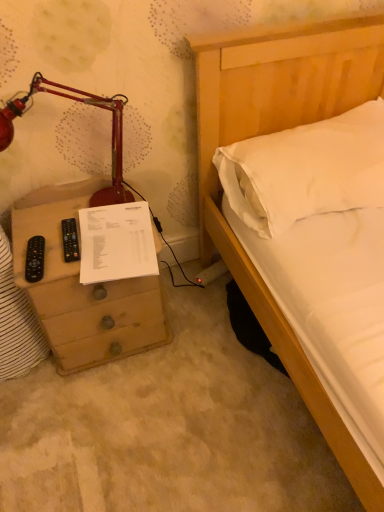
Question: Does point (256, 137) appear closer or farther from the camera than point (61, 229)?

Choices:
 (A) closer
 (B) farther

Answer: (B)

Question: From the image's perspective, is white soft pillow at upper right located above or below black plastic remote at left?

Choices:
 (A) above
 (B) below

Answer: (A)

Question: Which object is the farthest from the white paper at left?

Choices:
 (A) matte red lamp at left
 (B) black plastic remote at left
 (C) wooden chest of drawers at left
 (D) black plastic remote at left
 (E) white soft pillow at upper right

Answer: (E)

Question: Which object is positioned closest to the wooden chest of drawers at left?

Choices:
 (A) white soft pillow at upper right
 (B) white paper at left
 (C) matte red lamp at left
 (D) black plastic remote at left
 (E) black plastic remote at left

Answer: (B)